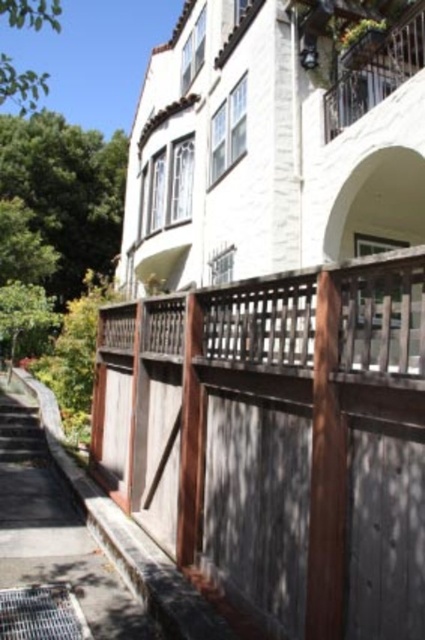
You are standing in front of a Mediterranean style building with a balcony and hanging plants. There is a brown wood fence at center. If you want to take a photo of the entire building without the fence blocking the view, how far back should you move?

The brown wood fence at center is 8.26 feet away from viewer. To avoid the fence blocking the view of the entire building, you should move back more than 8.26 feet.

In the scene shown: You are standing in front of the residential building and notice a specific point marked at coordinates (280, 438). Based on the scene description, can you determine what object this point is located on?

The point at coordinates (280, 438) is located on the brown wood fence at center.